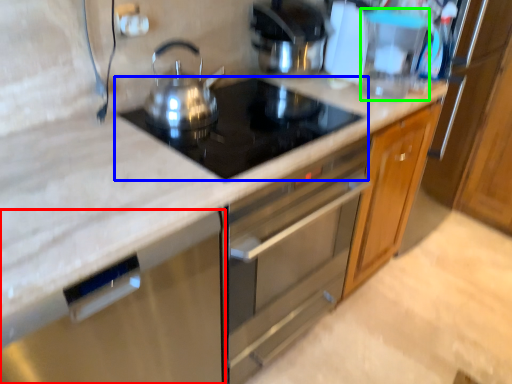
Question: Estimate the real-world distances between objects in this image. Which object is farther from dish washer (highlighted by a red box), gas stove (highlighted by a blue box) or appliance (highlighted by a green box)?

Choices:
 (A) gas stove
 (B) appliance

Answer: (B)